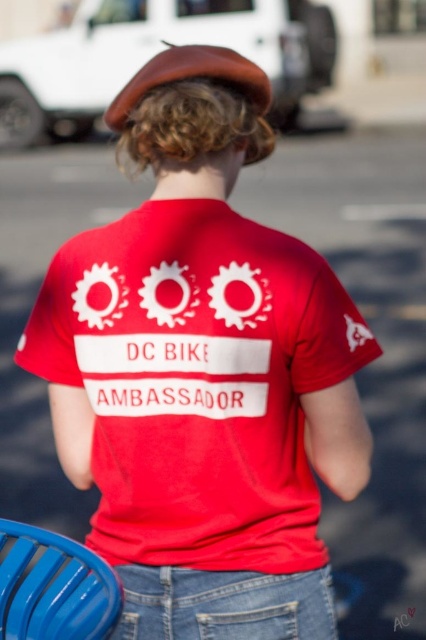
You are a photographer setting up a shoot in the described scene. You need to place a small camera bag that is 30 cm tall. The bag must be placed on either the denim at center or the blue plastic chair at lower left. Based on their heights, which object can safely support the camera bag without it toppling over?

The denim at center is taller than the blue plastic chair at lower left, so the camera bag can be safely placed on the denim at center as it is tall enough to support the bag without toppling over.